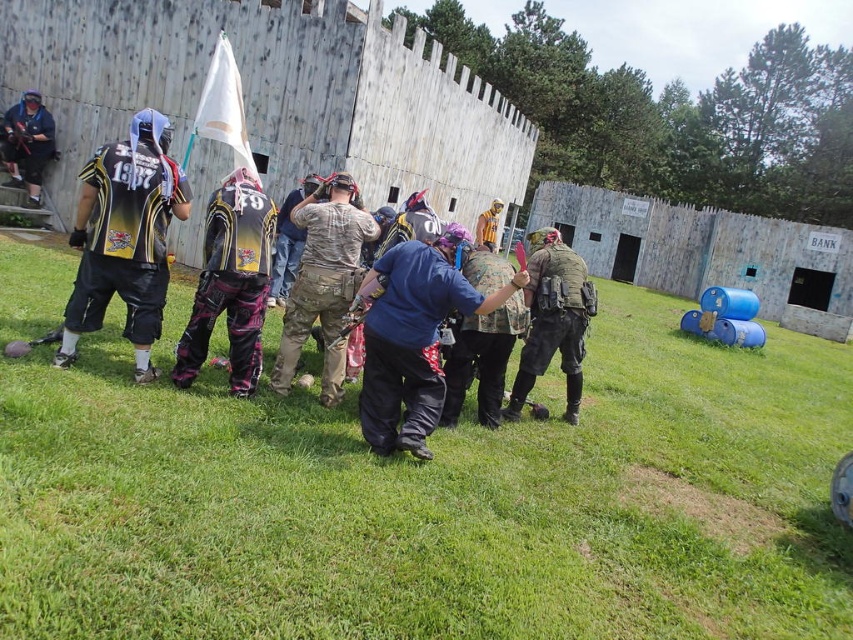
Question: Which object is farther from the camera taking this photo?

Choices:
 (A) green grass at center
 (B) camouflage fabric uniform at center

Answer: (B)

Question: Which object appears closest to the camera in this image?

Choices:
 (A) matte black jersey at left
 (B) camouflage fabric jacket at center

Answer: (A)

Question: Observing the image, what is the correct spatial positioning of matte black jersey at left in reference to blue matte shirt at center?

Choices:
 (A) left
 (B) right

Answer: (A)

Question: Which point is farther to the camera?

Choices:
 (A) (479, 312)
 (B) (10, 164)
 (C) (149, 472)

Answer: (B)

Question: Where is camouflage fabric pants at center located in relation to matte black jacket at upper left in the image?

Choices:
 (A) above
 (B) below

Answer: (B)

Question: Is camouflage pants at center closer to camera compared to leather pants at center?

Choices:
 (A) no
 (B) yes

Answer: (B)